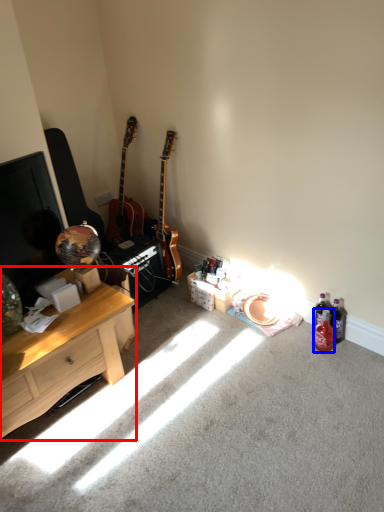
Question: Which of the following is the farthest to the observer, desk (highlighted by a red box) or bottle (highlighted by a blue box)?

Choices:
 (A) desk
 (B) bottle

Answer: (B)